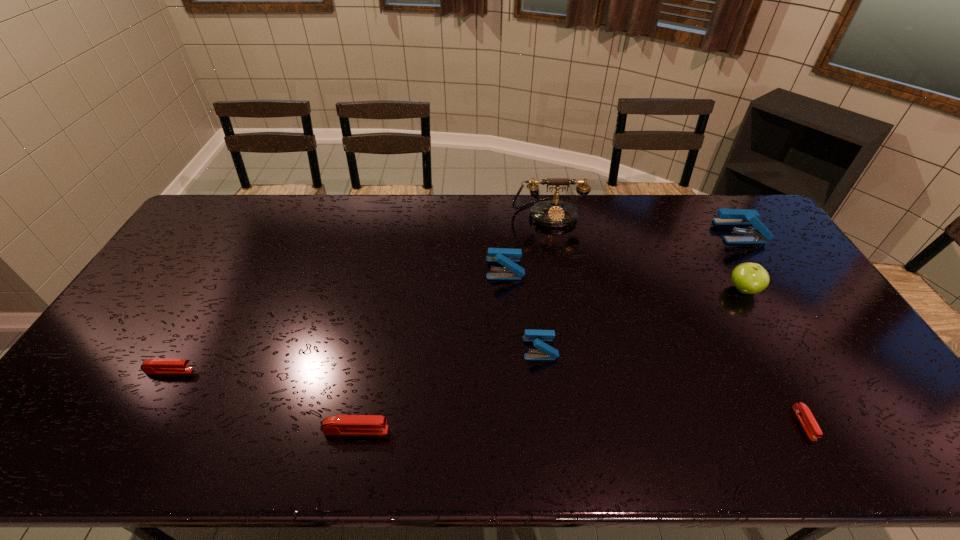
The height and width of the screenshot is (540, 960). I want to click on free spot between the green apple and the tallest object, so click(646, 252).

Locate an element on the screen. This screenshot has height=540, width=960. vacant region between the fourth tallest stapler and the third nearest stapler is located at coordinates (263, 401).

Locate an element on the screen. empty space that is in between the black telephone and the shortest object is located at coordinates (676, 318).

I want to click on vacant region between the tallest object and the rightmost red stapler, so click(x=676, y=318).

Choose which object is the nearest neighbor to the rightmost stapler. Please provide its 2D coordinates. Your answer should be formatted as a tuple, i.e. [(x, y)], where the tuple contains the x and y coordinates of a point satisfying the conditions above.

[(749, 278)]

Select which object is the fifth closest to the leftmost stapler. Please provide its 2D coordinates. Your answer should be formatted as a tuple, i.e. [(x, y)], where the tuple contains the x and y coordinates of a point satisfying the conditions above.

[(803, 413)]

Identify which stapler is the closest to the second biggest red stapler. Please provide its 2D coordinates. Your answer should be formatted as a tuple, i.e. [(x, y)], where the tuple contains the x and y coordinates of a point satisfying the conditions above.

[(339, 424)]

The height and width of the screenshot is (540, 960). What are the coordinates of `stapler that is the third nearest to the rightmost blue stapler` in the screenshot? It's located at (538, 337).

This screenshot has height=540, width=960. Identify the location of blue stapler that is the closest to the apple. (726, 216).

Where is `blue stapler that is the second closest to the third shortest object`? The height and width of the screenshot is (540, 960). blue stapler that is the second closest to the third shortest object is located at coordinates (506, 257).